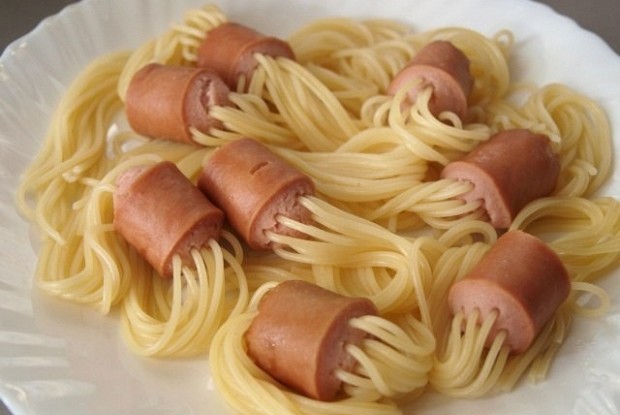
Image resolution: width=620 pixels, height=415 pixels. What are the coordinates of `table` in the screenshot? It's located at (20, 7), (593, 14).